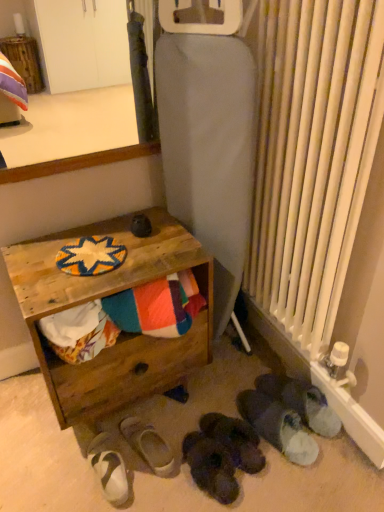
Question: Does point (132, 150) appear closer or farther from the camera than point (92, 449)?

Choices:
 (A) farther
 (B) closer

Answer: (A)

Question: Is wooden surface at upper left taller or shorter than white suede sandals at lower left, which ranks as the 1th footwear in left-to-right order?

Choices:
 (A) short
 (B) tall

Answer: (B)

Question: Which object is the farthest from the white fabric slipper at lower center, which appears as the fifth footwear when viewed from the right?

Choices:
 (A) black suede slippers at lower center, acting as the 4th footwear starting from the left
 (B) dark gray suede slippers at lower center, the third footwear in the left-to-right sequence
 (C) white fuzzy slippers at lower right, placed as the 5th footwear when sorted from left to right
 (D) wooden surface at upper left
 (E) white metal radiator at right

Answer: (D)

Question: Which is nearer to the black suede slippers at lower center, acting as the 4th footwear starting from the left?

Choices:
 (A) multicolored fabric at lower left
 (B) white fuzzy slippers at lower right, placed as the 5th footwear when sorted from left to right
 (C) white suede sandals at lower left, which appears as the 6th footwear when viewed from the right
 (D) wooden surface at upper left
 (E) wooden crate at lower left

Answer: (B)